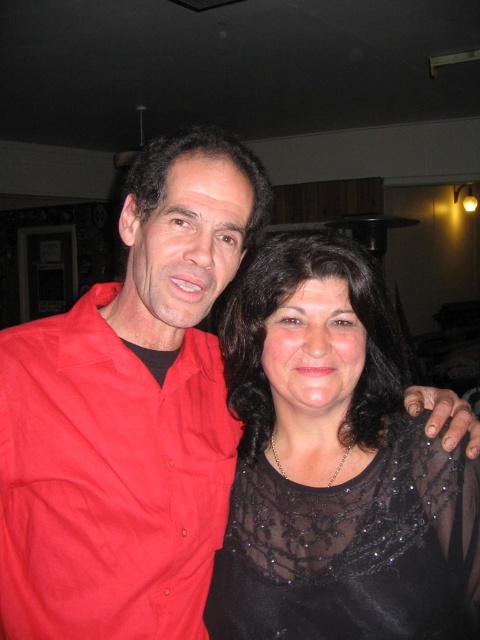
You are standing in the room and want to hand a drink to both the matte red shirt at left and the black sheer dress at center. Which one can you reach first without moving your position?

The black sheer dress at center can be reached first because it is closer to the viewer than the matte red shirt at left.